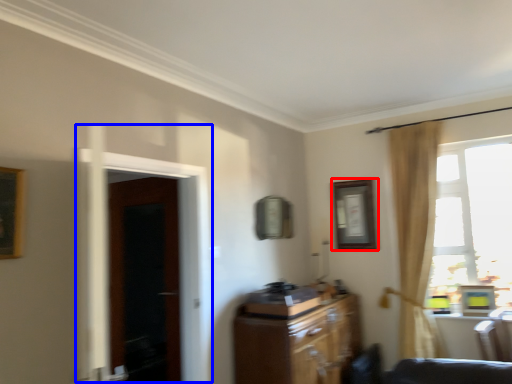
Question: Which object appears closest to the camera in this image, picture frame (highlighted by a red box) or screen door (highlighted by a blue box)?

Choices:
 (A) picture frame
 (B) screen door

Answer: (B)